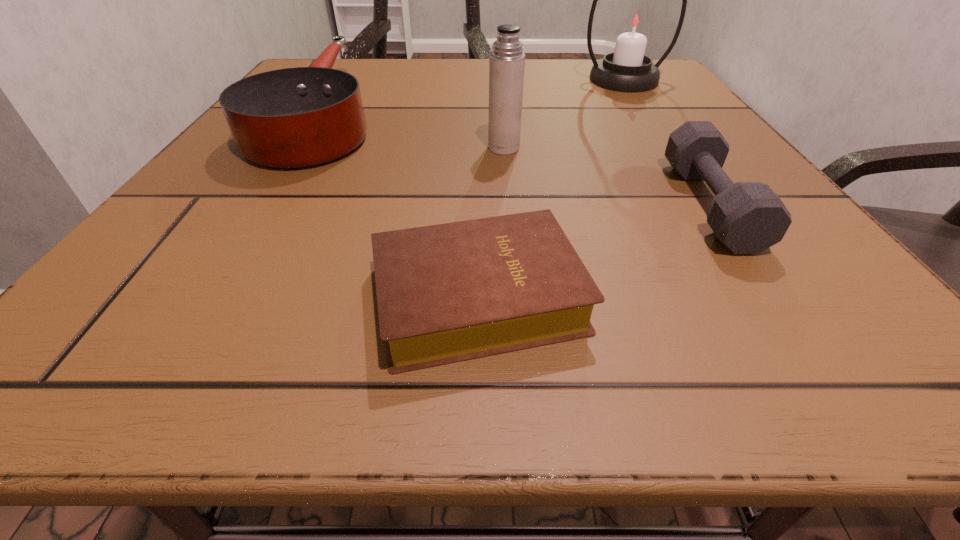
What are the coordinates of `oil lamp` in the screenshot? It's located at (635, 22).

The width and height of the screenshot is (960, 540). I want to click on thermos bottle, so click(x=507, y=61).

Identify the location of the third tallest object. This screenshot has height=540, width=960. (298, 117).

Find the location of a particular element. The height and width of the screenshot is (540, 960). pan is located at coordinates (298, 117).

This screenshot has height=540, width=960. In order to click on dumbbell in this screenshot , I will do `click(747, 217)`.

I want to click on the shortest object, so click(446, 293).

This screenshot has height=540, width=960. I want to click on vacant area located on the left of the tallest object, so click(x=440, y=80).

You are a GUI agent. You are given a task and a screenshot of the screen. Output one action in this format:
    pyautogui.click(x=<x>, y=<y>)
    Task: Click on the free space located on the left of the thermos bottle
    The height and width of the screenshot is (540, 960).
    Given the screenshot: What is the action you would take?
    pyautogui.click(x=435, y=147)

This screenshot has width=960, height=540. I want to click on vacant position located on the handle side of the pan, so click(x=353, y=66).

Locate an element on the screen. The height and width of the screenshot is (540, 960). free region located 0.110m on the handle side of the pan is located at coordinates (357, 59).